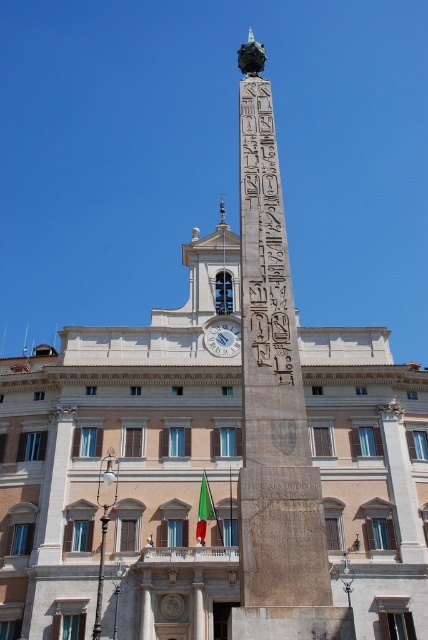
In the scene shown: You are an archaeologist examining the obelisk in the image. You notice a specific point marked at coordinates (264, 248). Based on the scene description, can you determine which part of the obelisk this point corresponds to?

The point at coordinates (264, 248) is located on the black stone hieroglyphs at center of the obelisk.

You are an architect examining the grand obelisk and the classical building in the image. You notice the black stone hieroglyphs at center and the white marble clock at center. Which object is positioned to the right of the other?

The black stone hieroglyphs at center is to the right of the white marble clock at center.